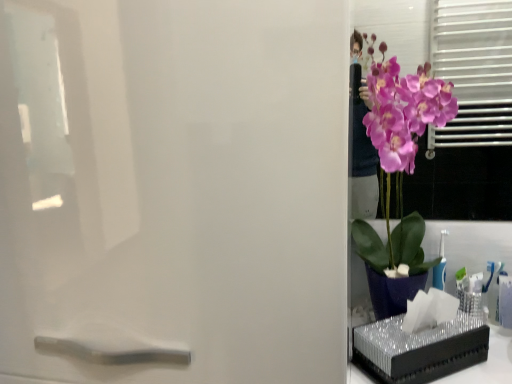
Question: Considering the positions of purple glossy orchid at right and metallic silver tissue box at right in the image, is purple glossy orchid at right taller or shorter than metallic silver tissue box at right?

Choices:
 (A) short
 (B) tall

Answer: (B)

Question: Based on their sizes in the image, would you say purple glossy orchid at right is bigger or smaller than metallic silver tissue box at right?

Choices:
 (A) big
 (B) small

Answer: (A)

Question: Considering the real-world distances, which object is closest to the metallic silver tissue box at right?

Choices:
 (A) purple glossy orchid at right
 (B) satin white screen door at right

Answer: (A)

Question: Which of these objects is positioned closest to the satin white screen door at right?

Choices:
 (A) purple glossy orchid at right
 (B) metallic silver tissue box at right

Answer: (A)